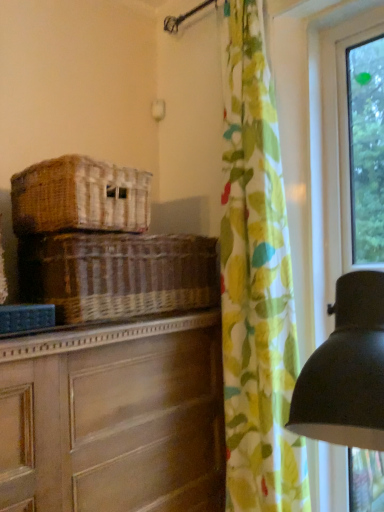
Question: Relative to woven brown basket at left, which is counted as the 2th basket, starting from the bottom, is woven brown basket at center, which is the first basket in bottom-to-top order, in front or behind?

Choices:
 (A) behind
 (B) front

Answer: (A)

Question: Considering the positions of woven brown basket at center, which is the first basket in bottom-to-top order, and woven brown basket at left, arranged as the first basket when viewed from the top, in the image, is woven brown basket at center, which is the first basket in bottom-to-top order, wider or thinner than woven brown basket at left, arranged as the first basket when viewed from the top,?

Choices:
 (A) wide
 (B) thin

Answer: (B)

Question: Based on their relative distances, which object is farther from the woven brown basket at center, the second basket in the top-to-bottom sequence?

Choices:
 (A) woven brown basket at left, which is counted as the 2th basket, starting from the bottom
 (B) wooden chest of drawers at left
 (C) floral fabric curtain at right

Answer: (C)

Question: Estimate the real-world distances between objects in this image. Which object is closer to the floral fabric curtain at right?

Choices:
 (A) wooden chest of drawers at left
 (B) woven brown basket at center, which is the first basket in bottom-to-top order
 (C) woven brown basket at left, which is counted as the 2th basket, starting from the bottom

Answer: (A)